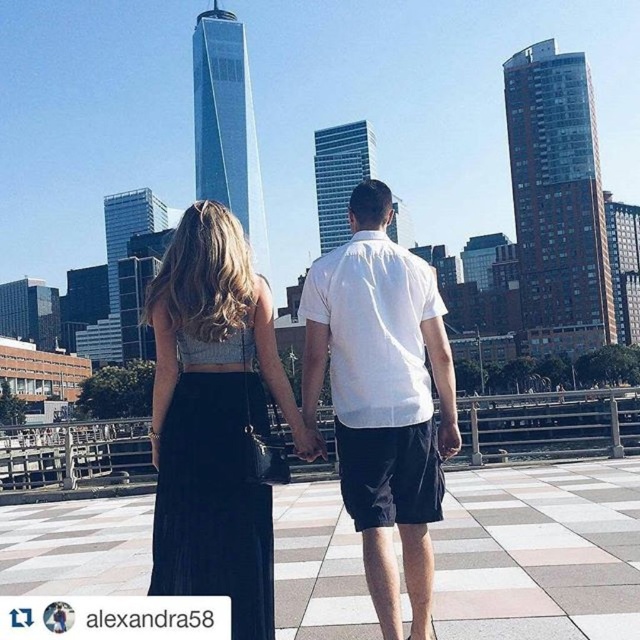
Can you confirm if satin black skirt at center is wider than white cotton shirt at center?

Correct, the width of satin black skirt at center exceeds that of white cotton shirt at center.

Describe the element at coordinates (212, 419) in the screenshot. I see `satin black skirt at center` at that location.

Find the location of a particular element. The width and height of the screenshot is (640, 640). satin black skirt at center is located at coordinates (212, 419).

Where is `satin black skirt at center`? The image size is (640, 640). satin black skirt at center is located at coordinates (212, 419).

Is white cotton shirt at center below matte black hand at center?

No.

In order to click on white cotton shirt at center in this screenshot , I will do `click(381, 397)`.

You are a GUI agent. You are given a task and a screenshot of the screen. Output one action in this format:
    pyautogui.click(x=<x>, y=<y>)
    Task: Click on the white cotton shirt at center
    
    Given the screenshot: What is the action you would take?
    pyautogui.click(x=381, y=397)

Does satin black skirt at center appear on the left side of matte black hand at center?

Yes, satin black skirt at center is to the left of matte black hand at center.

Is satin black skirt at center to the right of matte black hand at center from the viewer's perspective?

Incorrect, satin black skirt at center is not on the right side of matte black hand at center.

Is point (240, 465) more distant than point (307, 454)?

No.

You are a GUI agent. You are given a task and a screenshot of the screen. Output one action in this format:
    pyautogui.click(x=<x>, y=<y>)
    Task: Click on the satin black skirt at center
    Image resolution: width=640 pixels, height=640 pixels.
    Given the screenshot: What is the action you would take?
    pyautogui.click(x=212, y=419)